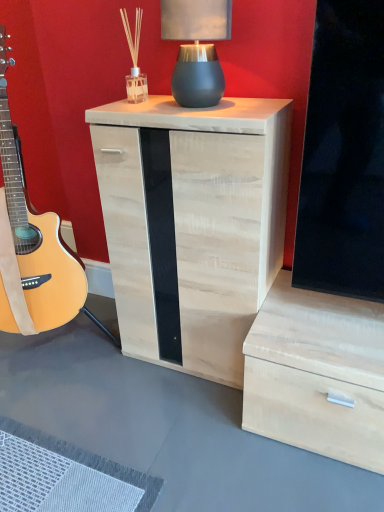
Question: From the image's perspective, is natural wood guitar at left under matte gray ceramic table lamp at upper center?

Choices:
 (A) no
 (B) yes

Answer: (B)

Question: Can you confirm if natural wood guitar at left is thinner than matte gray ceramic table lamp at upper center?

Choices:
 (A) yes
 (B) no

Answer: (B)

Question: From the image's perspective, is natural wood guitar at left over matte gray ceramic table lamp at upper center?

Choices:
 (A) no
 (B) yes

Answer: (A)

Question: Is natural wood guitar at left behind matte gray ceramic table lamp at upper center?

Choices:
 (A) yes
 (B) no

Answer: (B)

Question: Is matte gray ceramic table lamp at upper center at the back of natural wood guitar at left?

Choices:
 (A) no
 (B) yes

Answer: (A)

Question: Visually, is light wood/texture nightstand at center positioned to the left or to the right of matte gray ceramic table lamp at upper center?

Choices:
 (A) right
 (B) left

Answer: (B)

Question: Considering the positions of light wood/texture nightstand at center and matte gray ceramic table lamp at upper center in the image, is light wood/texture nightstand at center taller or shorter than matte gray ceramic table lamp at upper center?

Choices:
 (A) short
 (B) tall

Answer: (B)

Question: From a real-world perspective, is light wood/texture nightstand at center above or below matte gray ceramic table lamp at upper center?

Choices:
 (A) above
 (B) below

Answer: (B)

Question: In the image, is light wood/texture nightstand at center positioned in front of or behind matte gray ceramic table lamp at upper center?

Choices:
 (A) front
 (B) behind

Answer: (A)

Question: Visually, is matte gray ceramic table lamp at upper center positioned to the left or to the right of natural wood guitar at left?

Choices:
 (A) right
 (B) left

Answer: (A)

Question: Is matte gray ceramic table lamp at upper center wider or thinner than natural wood guitar at left?

Choices:
 (A) wide
 (B) thin

Answer: (B)

Question: From the image's perspective, is matte gray ceramic table lamp at upper center positioned above or below natural wood guitar at left?

Choices:
 (A) above
 (B) below

Answer: (A)

Question: In terms of size, does matte gray ceramic table lamp at upper center appear bigger or smaller than natural wood guitar at left?

Choices:
 (A) big
 (B) small

Answer: (B)

Question: From a real-world perspective, is natural wood guitar at left positioned above or below light wood/texture nightstand at center?

Choices:
 (A) below
 (B) above

Answer: (B)

Question: Based on their sizes in the image, would you say natural wood guitar at left is bigger or smaller than light wood/texture nightstand at center?

Choices:
 (A) small
 (B) big

Answer: (B)